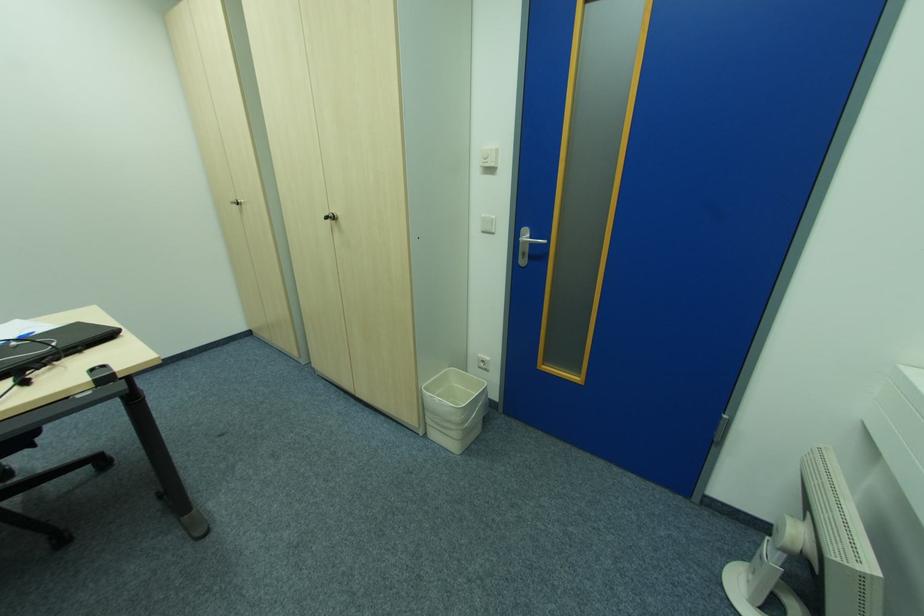
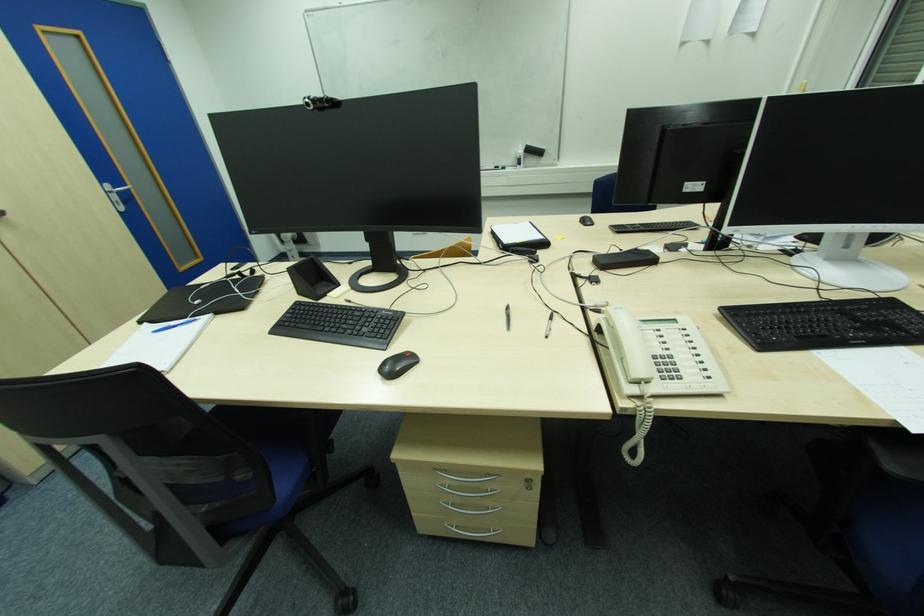
Where in the second image is the point corresponding to (x=526, y=256) from the first image?

(119, 204)